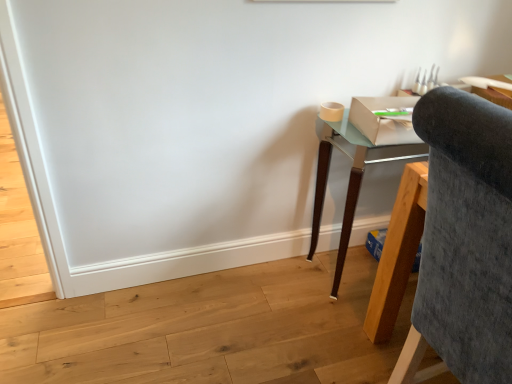
Image resolution: width=512 pixels, height=384 pixels. What are the coordinates of `velvet grey chair at right` in the screenshot? It's located at 464,241.

What do you see at coordinates (464, 241) in the screenshot?
I see `velvet grey chair at right` at bounding box center [464, 241].

The width and height of the screenshot is (512, 384). In order to click on teal glass desk at right in this screenshot , I will do `click(350, 175)`.

The height and width of the screenshot is (384, 512). Describe the element at coordinates (350, 175) in the screenshot. I see `teal glass desk at right` at that location.

This screenshot has height=384, width=512. In order to click on velvet grey chair at right in this screenshot , I will do `click(464, 241)`.

Visually, is teal glass desk at right positioned to the left or to the right of velvet grey chair at right?

teal glass desk at right is to the left of velvet grey chair at right.

Is the depth of teal glass desk at right less than that of velvet grey chair at right?

No, the depth of teal glass desk at right is greater than that of velvet grey chair at right.

Between point (313, 211) and point (492, 107), which one is positioned behind?

The point (313, 211) is behind.

From the image's perspective, is teal glass desk at right on velvet grey chair at right?

Yes, from the image's perspective, teal glass desk at right is above velvet grey chair at right.

From a real-world perspective, is teal glass desk at right positioned over velvet grey chair at right based on gravity?

No, from a real-world perspective, teal glass desk at right is not above velvet grey chair at right.

Looking at their sizes, would you say teal glass desk at right is wider or thinner than velvet grey chair at right?

Considering their sizes, teal glass desk at right looks slimmer than velvet grey chair at right.

Which of these two, teal glass desk at right or velvet grey chair at right, stands shorter?

teal glass desk at right.

Looking at the image, does teal glass desk at right seem bigger or smaller compared to velvet grey chair at right?

Clearly, teal glass desk at right is smaller in size than velvet grey chair at right.

Is teal glass desk at right located outside velvet grey chair at right?

Yes, teal glass desk at right is not within velvet grey chair at right.

Is teal glass desk at right far away from velvet grey chair at right?

Actually, teal glass desk at right and velvet grey chair at right are a little close together.

Is teal glass desk at right facing away from velvet grey chair at right?

No, teal glass desk at right is not facing the opposite direction of velvet grey chair at right.

How many degrees apart are the facing directions of teal glass desk at right and velvet grey chair at right?

The angular difference between teal glass desk at right and velvet grey chair at right is 88.9 degrees.

Identify the location of desk that is above the velvet grey chair at right (from the image's perspective). Image resolution: width=512 pixels, height=384 pixels. (350, 175).

Is velvet grey chair at right to the right of teal glass desk at right from the viewer's perspective?

Yes.

Is velvet grey chair at right behind teal glass desk at right?

No, velvet grey chair at right is closer to the camera.

Is point (425, 128) closer to camera compared to point (388, 160)?

Yes, point (425, 128) is in front of point (388, 160).

From the picture: From the image's perspective, which object appears higher, velvet grey chair at right or teal glass desk at right?

teal glass desk at right.

From a real-world perspective, which is physically below, velvet grey chair at right or teal glass desk at right?

From a 3D spatial view, teal glass desk at right is below.

Considering the relative sizes of velvet grey chair at right and teal glass desk at right in the image provided, is velvet grey chair at right thinner than teal glass desk at right?

In fact, velvet grey chair at right might be wider than teal glass desk at right.

Does velvet grey chair at right have a lesser height compared to teal glass desk at right?

Incorrect, the height of velvet grey chair at right does not fall short of that of teal glass desk at right.

Who is bigger, velvet grey chair at right or teal glass desk at right?

velvet grey chair at right is bigger.

Is velvet grey chair at right located outside teal glass desk at right?

That's correct, velvet grey chair at right is outside of teal glass desk at right.

Is velvet grey chair at right positioned far away from teal glass desk at right?

No, velvet grey chair at right is not far from teal glass desk at right.

Looking at this image, could you tell me if velvet grey chair at right is turned towards teal glass desk at right?

No, velvet grey chair at right does not turn towards teal glass desk at right.

Find the location of a particular element. Image resolution: width=512 pixels, height=384 pixels. chair below the teal glass desk at right (from the image's perspective) is located at coordinates (464, 241).

I want to click on desk directly beneath the velvet grey chair at right (from a real-world perspective), so [350, 175].

Find the location of `desk above the velvet grey chair at right (from the image's perspective)`. desk above the velvet grey chair at right (from the image's perspective) is located at coordinates (350, 175).